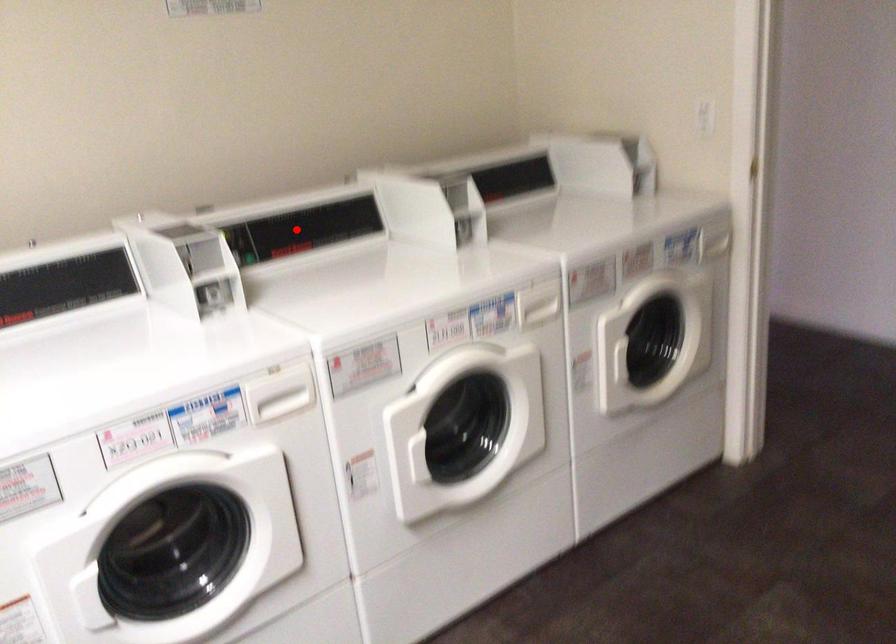
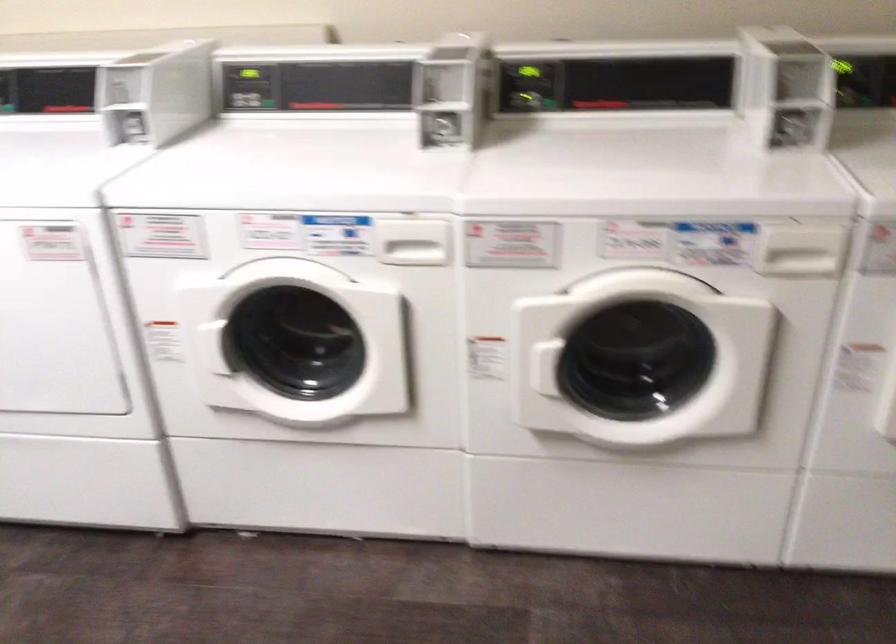
The point at the highlighted location is marked in the first image. Where is the corresponding point in the second image?

(613, 82)